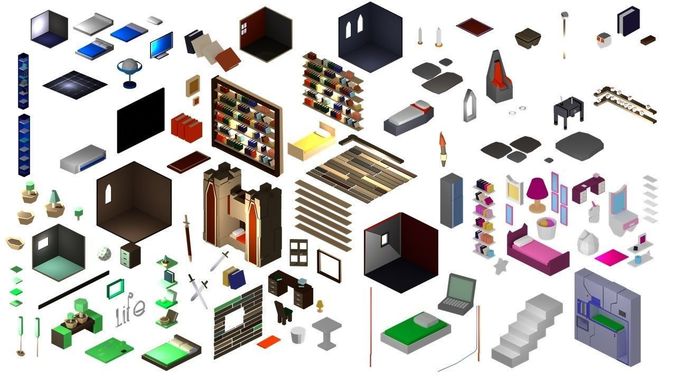
In order to click on rooms in this screenshot , I will do `click(48, 32)`, `click(260, 27)`, `click(389, 247)`, `click(128, 199)`, `click(63, 257)`.